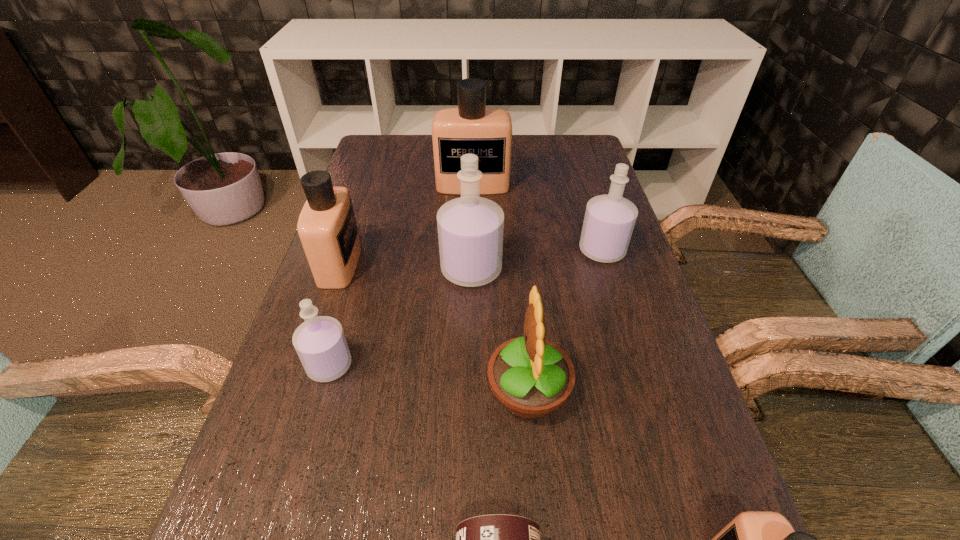
Locate which object ranks fifth in proximity to the yellow sunflower. Please provide its 2D coordinates. Your answer should be formatted as a tuple, i.e. [(x, y)], where the tuple contains the x and y coordinates of a point satisfying the conditions above.

[(609, 220)]

Identify which perfume is the sixth nearest to the yellow sunflower. Please provide its 2D coordinates. Your answer should be formatted as a tuple, i.e. [(x, y)], where the tuple contains the x and y coordinates of a point satisfying the conditions above.

[(471, 128)]

Where is `perfume that stands as the fourth closest to the sunflower`? The height and width of the screenshot is (540, 960). perfume that stands as the fourth closest to the sunflower is located at coordinates (609, 220).

Identify which beige perfume is the third closest to the rightmost purple perfume. Please provide its 2D coordinates. Your answer should be formatted as a tuple, i.e. [(x, y)], where the tuple contains the x and y coordinates of a point satisfying the conditions above.

[(754, 539)]

Where is `beige perfume that is the nearest to the can`? The image size is (960, 540). beige perfume that is the nearest to the can is located at coordinates (754, 539).

Identify which purple perfume is located as the nearest to the second biggest beige perfume. Please provide its 2D coordinates. Your answer should be formatted as a tuple, i.e. [(x, y)], where the tuple contains the x and y coordinates of a point satisfying the conditions above.

[(320, 343)]

Where is `purple perfume that is the third closest to the shortest object`? The width and height of the screenshot is (960, 540). purple perfume that is the third closest to the shortest object is located at coordinates (609, 220).

The height and width of the screenshot is (540, 960). Identify the location of vacant area that satisfies the following two spatial constraints: 1. on the front side of the rightmost purple perfume; 2. on the front label of the second smallest beige perfume. (606, 264).

This screenshot has width=960, height=540. Identify the location of free space that satisfies the following two spatial constraints: 1. on the front label of the second farthest beige perfume; 2. on the right side of the second purple perfume from right to left. (338, 269).

I want to click on free point that satisfies the following two spatial constraints: 1. on the front label of the second smallest beige perfume; 2. on the left side of the smallest purple perfume, so click(x=306, y=366).